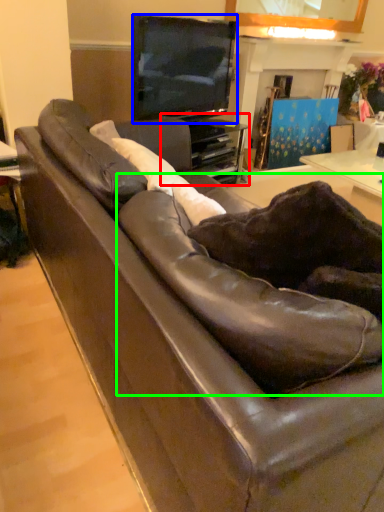
Question: Based on their relative distances, which object is nearer to entertainment center (highlighted by a red box)? Choose from television (highlighted by a blue box) and swivel chair (highlighted by a green box).

Choices:
 (A) television
 (B) swivel chair

Answer: (A)